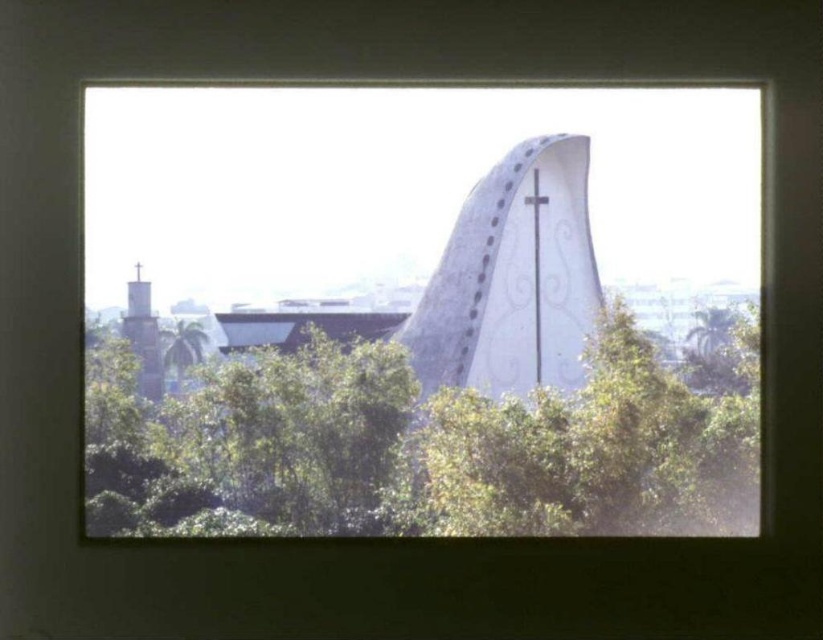
Between smooth gray stone spire at left and green leafy tree at lower left, which one has less height?

With less height is green leafy tree at lower left.

Does point (138, 385) come farther from viewer compared to point (198, 323)?

Yes, it is.

This screenshot has width=823, height=640. Find the location of `smooth gray stone spire at left`. smooth gray stone spire at left is located at coordinates (143, 337).

Is green leafy tree at center taller than green leafy tree at lower left?

Correct, green leafy tree at center is much taller as green leafy tree at lower left.

Between green leafy tree at center and green leafy tree at lower left, which one appears on the left side from the viewer's perspective?

From the viewer's perspective, green leafy tree at lower left appears more on the left side.

Which is behind, point (212, 513) or point (191, 352)?

Point (191, 352)

In order to click on green leafy tree at center in this screenshot , I will do `click(429, 442)`.

Between green leafy tree at center and smooth gray stone spire at left, which one is positioned lower?

green leafy tree at center is below.

Can you confirm if green leafy tree at center is thinner than smooth gray stone spire at left?

No.

Identify the location of green leafy tree at center. (429, 442).

I want to click on green leafy tree at center, so click(429, 442).